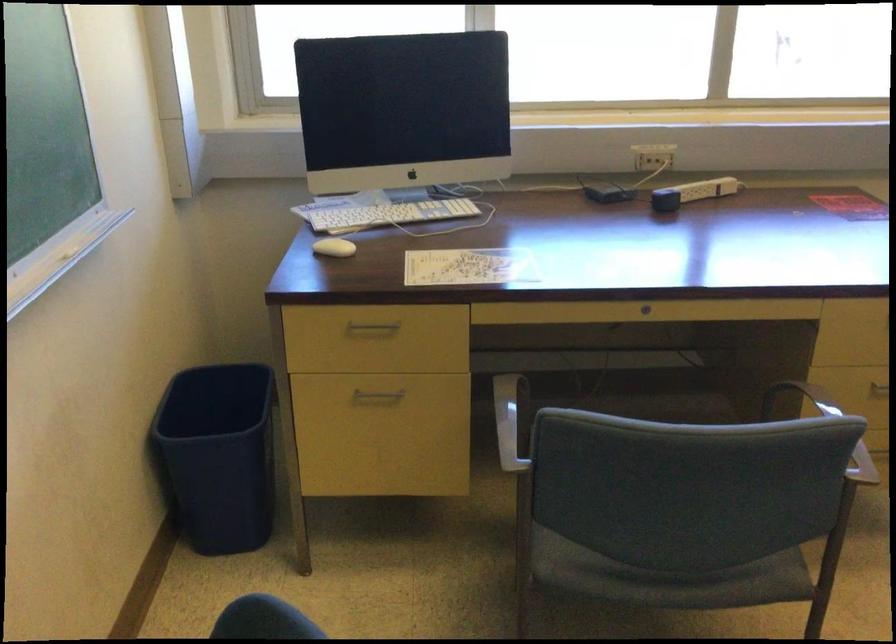
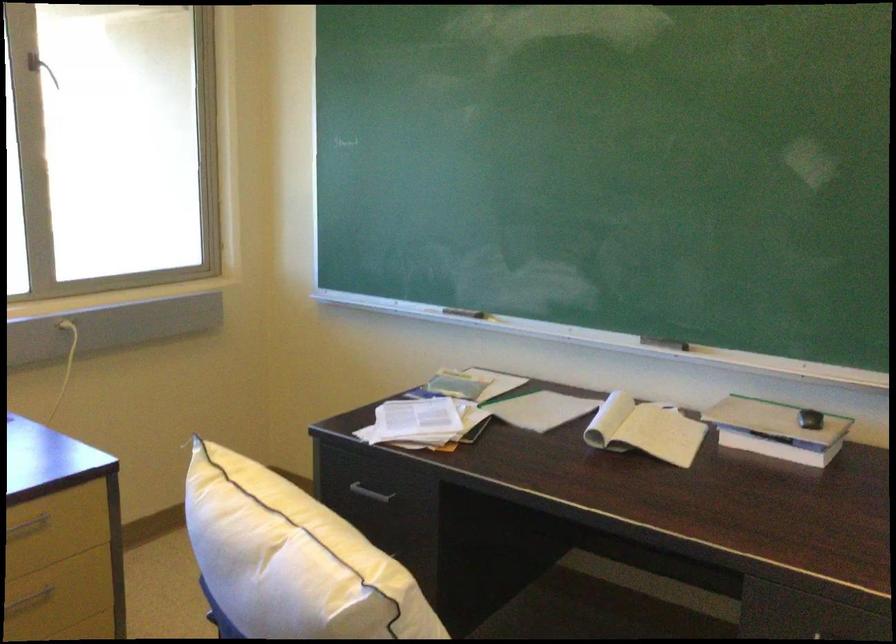
Question: Based on the continuous images, in which direction is the camera rotating? Reply with the corresponding letter.

Choices:
 (A) Left
 (B) Right
 (C) Up
 (D) Down

Answer: (B)